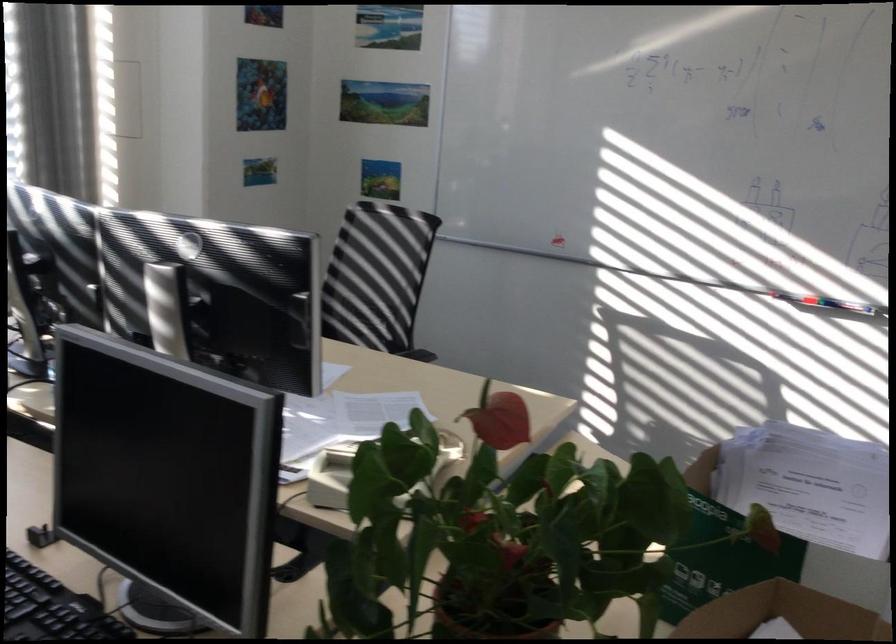
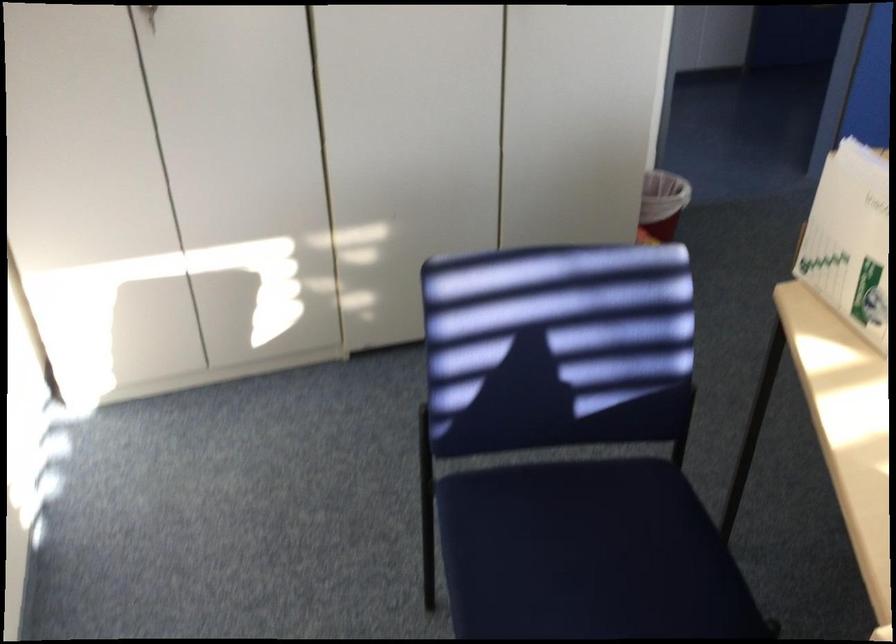
Locate, in the second image, the point that corresponds to (x=747, y=527) in the first image.

(849, 240)